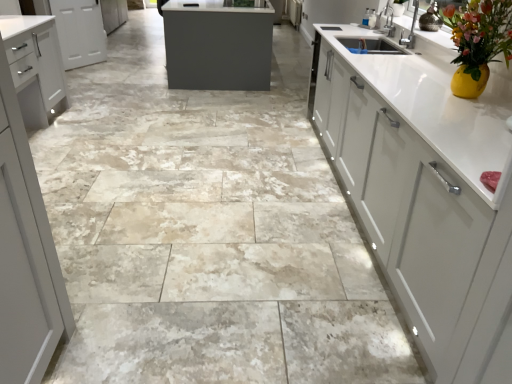
Locate an element on the screen. Image resolution: width=512 pixels, height=384 pixels. white matte cabinet at upper left, which is the 1th cabinetry from back to front is located at coordinates (79, 32).

What is the approximate width of white matte cabinet at upper left, which ranks as the 1th cabinetry in top-to-bottom order?

white matte cabinet at upper left, which ranks as the 1th cabinetry in top-to-bottom order, is 6.12 inches in width.

The width and height of the screenshot is (512, 384). Describe the element at coordinates (79, 32) in the screenshot. I see `white matte cabinet at upper left, which ranks as the 1th cabinetry in top-to-bottom order` at that location.

The width and height of the screenshot is (512, 384). What do you see at coordinates (35, 67) in the screenshot?
I see `white matte cabinet at left, which ranks as the second cabinetry in top-to-bottom order` at bounding box center [35, 67].

This screenshot has height=384, width=512. Find the location of `white matte cabinet at left, the first cabinetry viewed from the front`. white matte cabinet at left, the first cabinetry viewed from the front is located at coordinates (35, 67).

This screenshot has width=512, height=384. I want to click on white matte cabinet at upper left, which is the 1th cabinetry from back to front, so click(79, 32).

Can you confirm if white matte cabinet at left, which ranks as the second cabinetry in top-to-bottom order, is positioned to the left of white matte cabinet at upper left, which is the 1th cabinetry from back to front?

No, white matte cabinet at left, which ranks as the second cabinetry in top-to-bottom order, is not to the left of white matte cabinet at upper left, which is the 1th cabinetry from back to front.

Considering the positions of objects white matte cabinet at left, the first cabinetry viewed from the front, and white matte cabinet at upper left, the 2th cabinetry when ordered from front to back, in the image provided, who is in front, white matte cabinet at left, the first cabinetry viewed from the front, or white matte cabinet at upper left, the 2th cabinetry when ordered from front to back,?

white matte cabinet at left, the first cabinetry viewed from the front, is closer to the camera.

Considering the positions of point (3, 38) and point (82, 62), is point (3, 38) closer or farther from the camera than point (82, 62)?

Point (3, 38).

From the image's perspective, relative to white matte cabinet at upper left, which is the 1th cabinetry from back to front, is white matte cabinet at left, the 2th cabinetry positioned from the back, above or below?

white matte cabinet at left, the 2th cabinetry positioned from the back, is situated lower than white matte cabinet at upper left, which is the 1th cabinetry from back to front, in the image.

From a real-world perspective, does white matte cabinet at left, arranged as the first cabinetry when ordered from the bottom, sit lower than white matte cabinet at upper left, which appears as the second cabinetry when ordered from the bottom?

No, from a real-world perspective, white matte cabinet at left, arranged as the first cabinetry when ordered from the bottom, is not under white matte cabinet at upper left, which appears as the second cabinetry when ordered from the bottom.

Between white matte cabinet at left, which ranks as the second cabinetry in top-to-bottom order, and white matte cabinet at upper left, the 2th cabinetry when ordered from front to back, which one has larger width?

white matte cabinet at left, which ranks as the second cabinetry in top-to-bottom order.

Can you confirm if white matte cabinet at left, arranged as the first cabinetry when ordered from the bottom, is taller than white matte cabinet at upper left, which ranks as the 1th cabinetry in top-to-bottom order?

Yes, white matte cabinet at left, arranged as the first cabinetry when ordered from the bottom, is taller than white matte cabinet at upper left, which ranks as the 1th cabinetry in top-to-bottom order.

Considering the relative sizes of white matte cabinet at left, which ranks as the second cabinetry in top-to-bottom order, and white matte cabinet at upper left, which ranks as the 1th cabinetry in top-to-bottom order, in the image provided, is white matte cabinet at left, which ranks as the second cabinetry in top-to-bottom order, bigger than white matte cabinet at upper left, which ranks as the 1th cabinetry in top-to-bottom order,?

Correct, white matte cabinet at left, which ranks as the second cabinetry in top-to-bottom order, is larger in size than white matte cabinet at upper left, which ranks as the 1th cabinetry in top-to-bottom order.

Is white matte cabinet at left, the 2th cabinetry positioned from the back, surrounding white matte cabinet at upper left, the 2th cabinetry when ordered from front to back?

No.

Is white matte cabinet at left, which ranks as the second cabinetry in top-to-bottom order, positioned far away from white matte cabinet at upper left, which is the 1th cabinetry from back to front?

Absolutely, white matte cabinet at left, which ranks as the second cabinetry in top-to-bottom order, is distant from white matte cabinet at upper left, which is the 1th cabinetry from back to front.

Does white matte cabinet at left, the 2th cabinetry positioned from the back, turn towards white matte cabinet at upper left, the 2th cabinetry when ordered from front to back?

No.

What's the angular difference between white matte cabinet at left, the first cabinetry viewed from the front, and white matte cabinet at upper left, which ranks as the 1th cabinetry in top-to-bottom order,'s facing directions?

They differ by 32.5 degrees in their facing directions.

Measure the distance between white matte cabinet at left, which ranks as the second cabinetry in top-to-bottom order, and white matte cabinet at upper left, which appears as the second cabinetry when ordered from the bottom.

white matte cabinet at left, which ranks as the second cabinetry in top-to-bottom order, and white matte cabinet at upper left, which appears as the second cabinetry when ordered from the bottom, are 6.75 feet apart.

You are a GUI agent. You are given a task and a screenshot of the screen. Output one action in this format:
    pyautogui.click(x=<x>, y=<y>)
    Task: Click on the cabinetry on the right of white matte cabinet at upper left, which is the 1th cabinetry from back to front
    The image size is (512, 384).
    Given the screenshot: What is the action you would take?
    pyautogui.click(x=35, y=67)

Can you confirm if white matte cabinet at upper left, which ranks as the 1th cabinetry in top-to-bottom order, is positioned to the left of white matte cabinet at left, arranged as the first cabinetry when ordered from the bottom?

Indeed, white matte cabinet at upper left, which ranks as the 1th cabinetry in top-to-bottom order, is positioned on the left side of white matte cabinet at left, arranged as the first cabinetry when ordered from the bottom.

Relative to white matte cabinet at left, the first cabinetry viewed from the front, is white matte cabinet at upper left, which ranks as the 1th cabinetry in top-to-bottom order, in front or behind?

In the image, white matte cabinet at upper left, which ranks as the 1th cabinetry in top-to-bottom order, appears behind white matte cabinet at left, the first cabinetry viewed from the front.

Considering the points (94, 58) and (59, 55), which point is in front, point (94, 58) or point (59, 55)?

The point (59, 55) is more forward.

From the image's perspective, between white matte cabinet at upper left, which ranks as the 1th cabinetry in top-to-bottom order, and white matte cabinet at left, the first cabinetry viewed from the front, which one is located above?

white matte cabinet at upper left, which ranks as the 1th cabinetry in top-to-bottom order, appears higher in the image.

From a real-world perspective, which object stands above the other?

From a 3D spatial view, white matte cabinet at left, the first cabinetry viewed from the front, is above.

Which of these two, white matte cabinet at upper left, which appears as the second cabinetry when ordered from the bottom, or white matte cabinet at left, the first cabinetry viewed from the front, is wider?

white matte cabinet at left, the first cabinetry viewed from the front, is wider.

Is white matte cabinet at upper left, the 2th cabinetry when ordered from front to back, taller than white matte cabinet at left, the 2th cabinetry positioned from the back?

No, white matte cabinet at upper left, the 2th cabinetry when ordered from front to back, is not taller than white matte cabinet at left, the 2th cabinetry positioned from the back.

Considering the relative sizes of white matte cabinet at upper left, which appears as the second cabinetry when ordered from the bottom, and white matte cabinet at left, arranged as the first cabinetry when ordered from the bottom, in the image provided, is white matte cabinet at upper left, which appears as the second cabinetry when ordered from the bottom, smaller than white matte cabinet at left, arranged as the first cabinetry when ordered from the bottom,?

Correct, white matte cabinet at upper left, which appears as the second cabinetry when ordered from the bottom, occupies less space than white matte cabinet at left, arranged as the first cabinetry when ordered from the bottom.

Is white matte cabinet at left, arranged as the first cabinetry when ordered from the bottom, a part of white matte cabinet at upper left, the 2th cabinetry when ordered from front to back?

No.

Looking at this image, is white matte cabinet at upper left, which ranks as the 1th cabinetry in top-to-bottom order, directly adjacent to white matte cabinet at left, arranged as the first cabinetry when ordered from the bottom?

No, white matte cabinet at upper left, which ranks as the 1th cabinetry in top-to-bottom order, is not in contact with white matte cabinet at left, arranged as the first cabinetry when ordered from the bottom.

Is white matte cabinet at upper left, which appears as the second cabinetry when ordered from the bottom, facing away from white matte cabinet at left, the 2th cabinetry positioned from the back?

No, white matte cabinet at upper left, which appears as the second cabinetry when ordered from the bottom,'s orientation is not away from white matte cabinet at left, the 2th cabinetry positioned from the back.

How different are the orientations of white matte cabinet at upper left, which is the 1th cabinetry from back to front, and white matte cabinet at left, the first cabinetry viewed from the front, in degrees?

32.5 degrees separate the facing orientations of white matte cabinet at upper left, which is the 1th cabinetry from back to front, and white matte cabinet at left, the first cabinetry viewed from the front.

Measure the distance from white matte cabinet at upper left, which appears as the second cabinetry when ordered from the bottom, to white matte cabinet at left, the 2th cabinetry positioned from the back.

white matte cabinet at upper left, which appears as the second cabinetry when ordered from the bottom, and white matte cabinet at left, the 2th cabinetry positioned from the back, are 6.75 feet apart.

At what (x,y) coordinates should I click in order to perform the action: click on cabinetry that is above the white matte cabinet at left, arranged as the first cabinetry when ordered from the bottom (from the image's perspective). Please return your answer as a coordinate pair (x, y). This screenshot has width=512, height=384. Looking at the image, I should click on (79, 32).

The width and height of the screenshot is (512, 384). Find the location of `cabinetry above the white matte cabinet at upper left, which is the 1th cabinetry from back to front (from a real-world perspective)`. cabinetry above the white matte cabinet at upper left, which is the 1th cabinetry from back to front (from a real-world perspective) is located at coordinates (35, 67).

Identify the location of cabinetry that is on the right side of white matte cabinet at upper left, which ranks as the 1th cabinetry in top-to-bottom order. (35, 67).